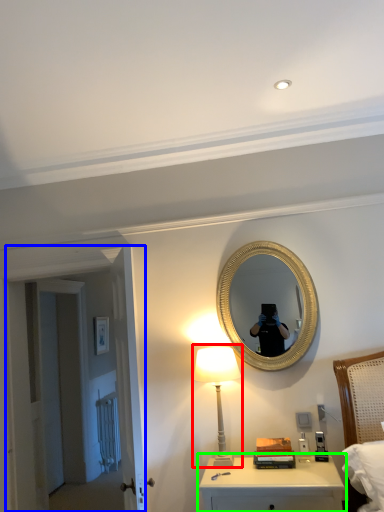
Question: Based on their relative distances, which object is nearer to table lamp (highlighted by a red box)? Choose from door (highlighted by a blue box) and nightstand (highlighted by a green box).

Choices:
 (A) door
 (B) nightstand

Answer: (B)